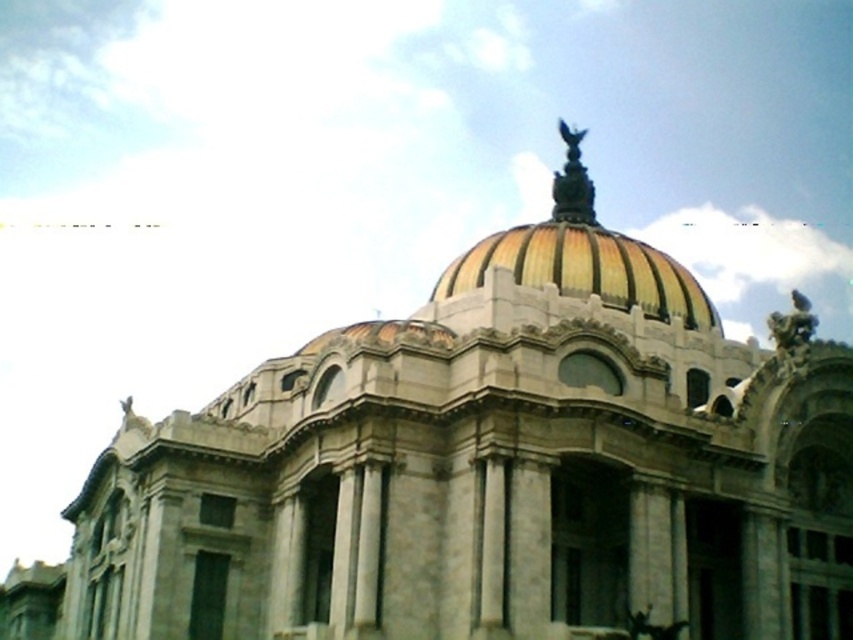
How distant is gold mosaic dome at center from bronze statue at upper right?

gold mosaic dome at center is 18.42 meters from bronze statue at upper right.

Between gold mosaic dome at center and bronze statue at upper right, which one is positioned higher?

gold mosaic dome at center is higher up.

I want to click on gold mosaic dome at center, so click(x=583, y=257).

Does gold mosaic dome at center come behind gold metallic statue at top?

No, it is in front of gold metallic statue at top.

From the picture: Is gold mosaic dome at center thinner than gold metallic statue at top?

In fact, gold mosaic dome at center might be wider than gold metallic statue at top.

Is point (604, 275) farther from camera compared to point (567, 131)?

No, (604, 275) is in front of (567, 131).

Locate an element on the screen. The height and width of the screenshot is (640, 853). gold mosaic dome at center is located at coordinates (583, 257).

Does point (560, 198) come closer to viewer compared to point (795, 296)?

No, (560, 198) is behind (795, 296).

Can you confirm if gold metallic statue at top is bigger than bronze statue at upper right?

Actually, gold metallic statue at top might be smaller than bronze statue at upper right.

Locate an element on the screen. The height and width of the screenshot is (640, 853). gold metallic statue at top is located at coordinates (572, 182).